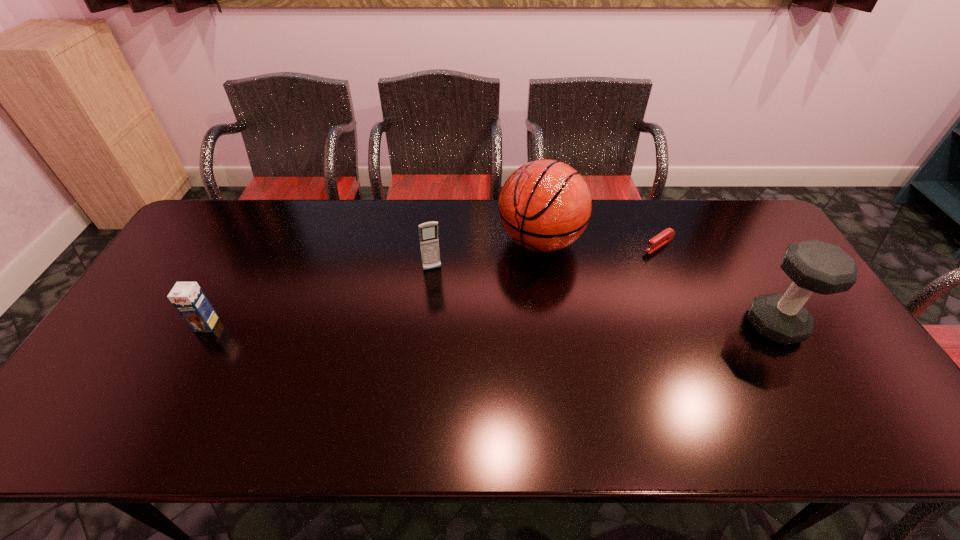
I want to click on free region that satisfies the following two spatial constraints: 1. on the front label of the second shortest object; 2. on the right side of the rightmost object, so click(206, 325).